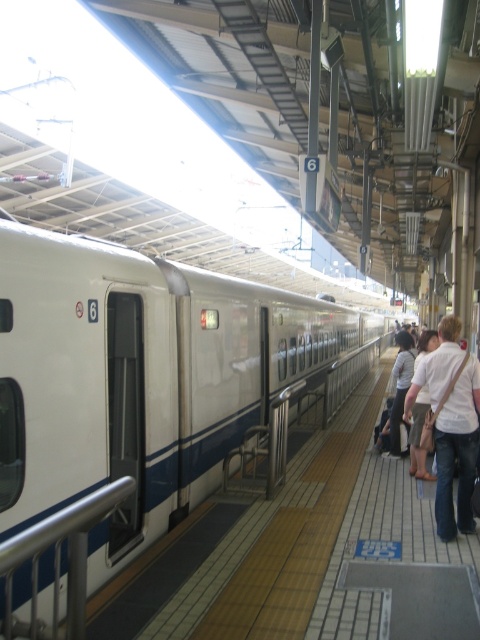
What do you see at coordinates (140, 378) in the screenshot? I see `white glossy train at center` at bounding box center [140, 378].

Which is behind, point (289, 412) or point (439, 394)?

Positioned behind is point (289, 412).

Locate an element on the screen. white glossy train at center is located at coordinates (140, 378).

Can you confirm if white glossy train at center is wider than silver metallic rail at lower left?

Yes, white glossy train at center is wider than silver metallic rail at lower left.

Is white glossy train at center smaller than silver metallic rail at lower left?

Incorrect, white glossy train at center is not smaller in size than silver metallic rail at lower left.

Who is more forward, (x=241, y=440) or (x=1, y=548)?

Positioned in front is point (x=1, y=548).

Find the location of a particular element. white glossy train at center is located at coordinates (140, 378).

Is point (16, 634) farther from viewer compared to point (418, 387)?

No.

Measure the distance between silver metallic rail at lower left and camera.

The distance of silver metallic rail at lower left from camera is 2.07 meters.

I want to click on silver metallic rail at lower left, so click(x=58, y=561).